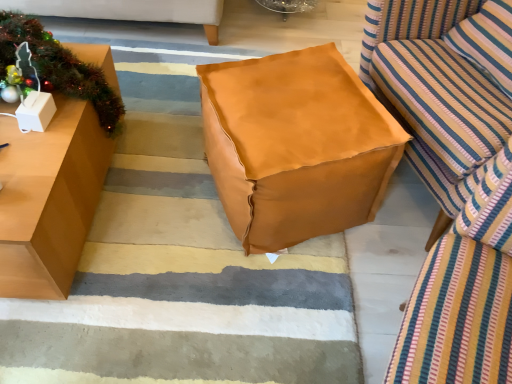
Question: Does white cardboard box at left have a larger size compared to metallic green garland at left?

Choices:
 (A) no
 (B) yes

Answer: (A)

Question: Does white cardboard box at left have a greater height compared to metallic green garland at left?

Choices:
 (A) no
 (B) yes

Answer: (A)

Question: Is metallic green garland at left at the back of white cardboard box at left?

Choices:
 (A) yes
 (B) no

Answer: (A)

Question: Is white cardboard box at left shorter than metallic green garland at left?

Choices:
 (A) yes
 (B) no

Answer: (A)

Question: Can you confirm if white cardboard box at left is wider than metallic green garland at left?

Choices:
 (A) yes
 (B) no

Answer: (B)

Question: Does white cardboard box at left have a smaller size compared to metallic green garland at left?

Choices:
 (A) yes
 (B) no

Answer: (A)

Question: Is striped fabric studio couch at right thinner than brown leather ottoman at center?

Choices:
 (A) no
 (B) yes

Answer: (B)

Question: From a real-world perspective, is striped fabric studio couch at right physically below brown leather ottoman at center?

Choices:
 (A) yes
 (B) no

Answer: (B)

Question: Is striped fabric studio couch at right completely or partially outside of brown leather ottoman at center?

Choices:
 (A) no
 (B) yes

Answer: (B)

Question: Is striped fabric studio couch at right bigger than brown leather ottoman at center?

Choices:
 (A) yes
 (B) no

Answer: (A)

Question: From the image's perspective, is striped fabric studio couch at right located above brown leather ottoman at center?

Choices:
 (A) no
 (B) yes

Answer: (A)

Question: Is striped fabric studio couch at right to the right of brown leather ottoman at center from the viewer's perspective?

Choices:
 (A) no
 (B) yes

Answer: (B)

Question: Is brown leather ottoman at center shorter than white cardboard box at left?

Choices:
 (A) no
 (B) yes

Answer: (B)